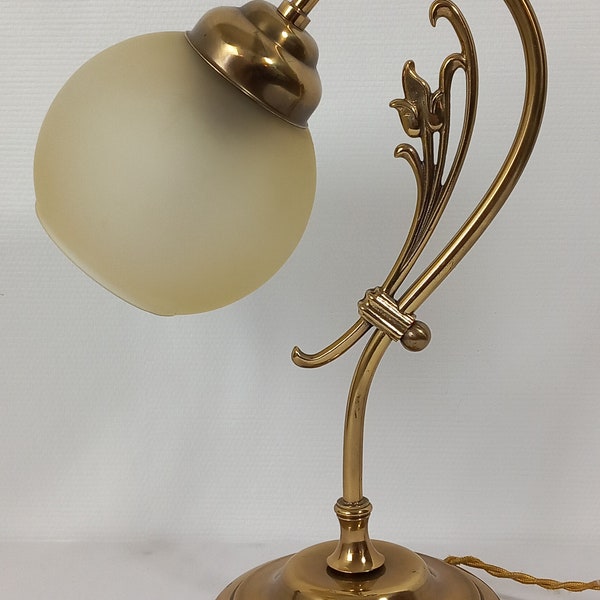
The image size is (600, 600). Identify the location of behind lamp. (356, 149).